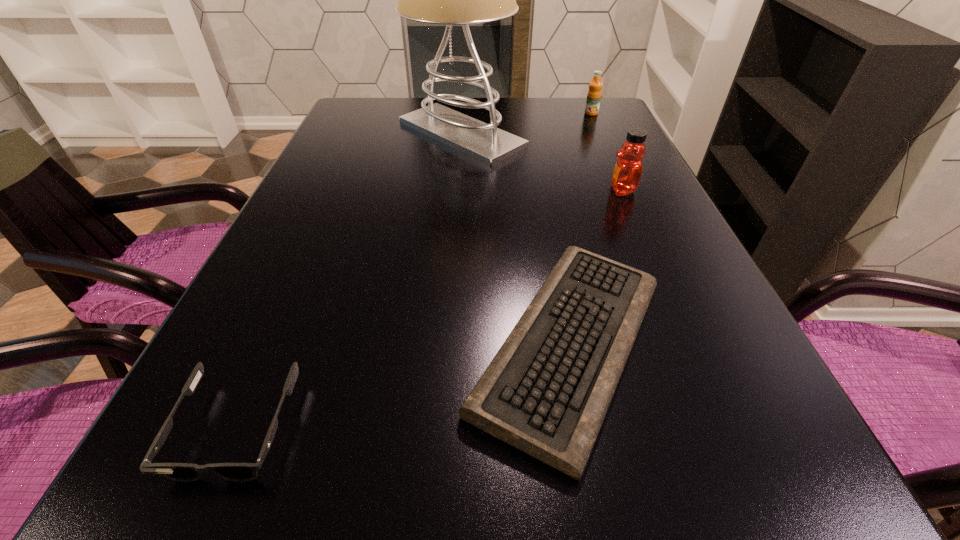
Find the location of a particular element. The width and height of the screenshot is (960, 540). unoccupied area between the third tallest object and the tallest object is located at coordinates (526, 124).

The height and width of the screenshot is (540, 960). I want to click on vacant space in between the computer keyboard and the table lamp, so click(516, 240).

Locate an element on the screen. This screenshot has width=960, height=540. free area in between the leftmost object and the computer keyboard is located at coordinates (403, 386).

You are a GUI agent. You are given a task and a screenshot of the screen. Output one action in this format:
    pyautogui.click(x=<x>, y=<y>)
    Task: Click on the vacant space that's between the leftmost object and the orange juice
    
    Given the screenshot: What is the action you would take?
    pos(414,271)

Find the location of a particular element. The image size is (960, 540). object that is the closest to the computer keyboard is located at coordinates (626, 177).

Select which object appears as the second closest to the third tallest object. Please provide its 2D coordinates. Your answer should be formatted as a tuple, i.e. [(x, y)], where the tuple contains the x and y coordinates of a point satisfying the conditions above.

[(626, 177)]

What are the coordinates of `free location that satisfies the following two spatial constraints: 1. on the front label of the honey; 2. on the temples of the leftmost object` in the screenshot? It's located at (726, 428).